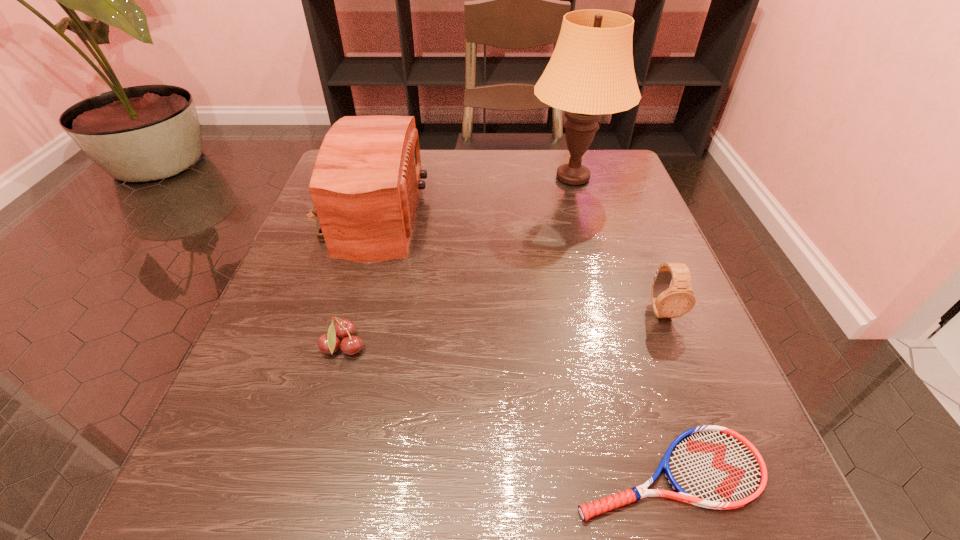
Identify the location of free space located 0.250m on the face of the third farthest object. This screenshot has width=960, height=540. (x=730, y=485).

This screenshot has width=960, height=540. I want to click on free location located on the leaves of the second nearest object, so click(410, 348).

Identify the location of vacant region located on the left of the nearest object. (483, 473).

Where is `lampshade that is at the far edge`? The image size is (960, 540). lampshade that is at the far edge is located at coordinates (591, 72).

Where is `radio receiver that is positioned at the far edge`? This screenshot has width=960, height=540. radio receiver that is positioned at the far edge is located at coordinates [365, 183].

Find the location of a particular element. This screenshot has height=540, width=960. object situated at the near edge is located at coordinates (714, 467).

I want to click on radio receiver at the left edge, so click(365, 183).

Identify the location of cherry that is at the left edge. The image size is (960, 540). (344, 329).

I want to click on lampshade that is at the right edge, so click(x=591, y=72).

The image size is (960, 540). In order to click on watch that is at the right edge in this screenshot , I will do `click(668, 302)`.